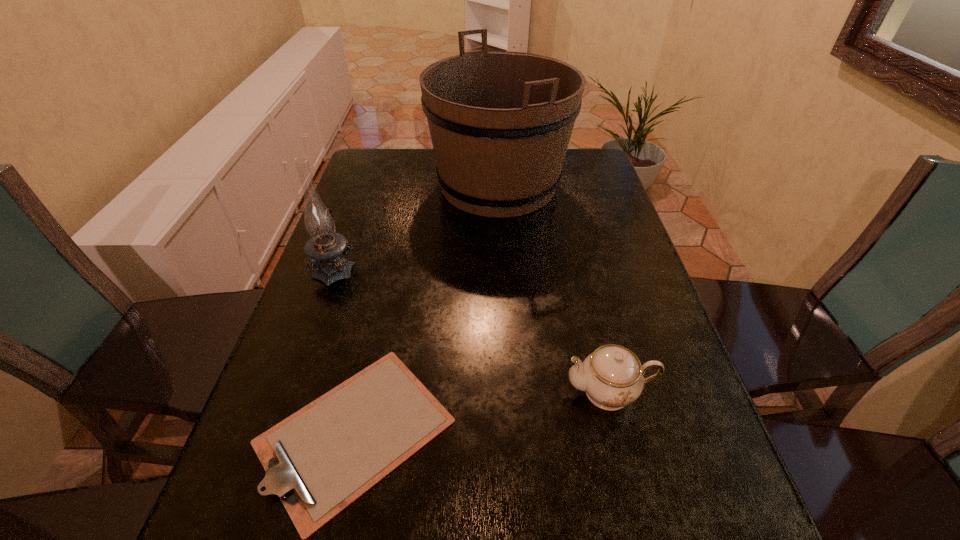
Locate an element on the screen. Image resolution: width=960 pixels, height=540 pixels. vacant point located between the oil lamp and the second shortest object is located at coordinates (472, 329).

The width and height of the screenshot is (960, 540). I want to click on free point between the farthest object and the third tallest object, so coord(554,288).

Locate an element on the screen. vacant area that lies between the oil lamp and the farthest object is located at coordinates (417, 226).

Locate an element on the screen. The width and height of the screenshot is (960, 540). free space between the bucket and the oil lamp is located at coordinates (417, 226).

At what (x,y) coordinates should I click in order to perform the action: click on the third closest object to the oil lamp. Please return your answer as a coordinate pair (x, y). The height and width of the screenshot is (540, 960). Looking at the image, I should click on (612, 376).

Identify which object is the third closest to the chinaware. Please provide its 2D coordinates. Your answer should be formatted as a tuple, i.e. [(x, y)], where the tuple contains the x and y coordinates of a point satisfying the conditions above.

[(324, 248)]